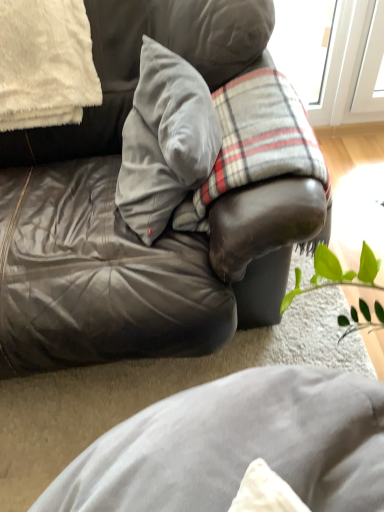
Question: Is plaid fabric at center spatially inside leather couch at center, or outside of it?

Choices:
 (A) inside
 (B) outside

Answer: (A)

Question: Based on their sizes in the image, would you say plaid fabric at center is bigger or smaller than leather couch at center?

Choices:
 (A) small
 (B) big

Answer: (A)

Question: Which of these objects is positioned closest to the leather couch at center?

Choices:
 (A) velvet gray pillow at center, the 1th pillow positioned from the right
 (B) white fluffy pillow at upper left, the second pillow when ordered from right to left
 (C) plaid fabric at center

Answer: (A)

Question: Estimate the real-world distances between objects in this image. Which object is farther from the velvet gray pillow at center, which ranks as the 2th pillow in left-to-right order?

Choices:
 (A) plaid fabric at center
 (B) leather couch at center
 (C) white fluffy pillow at upper left, arranged as the first pillow when viewed from the left

Answer: (C)